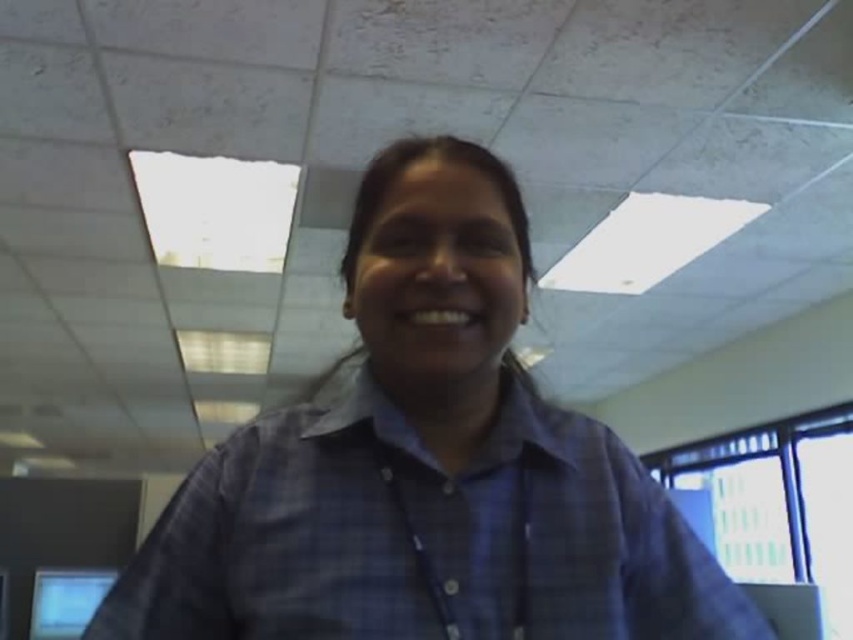
You are an office worker trying to locate your monitor. You see the blue plaid shirt at center and the matte black monitor at lower left. Which object is positioned higher in the image?

The blue plaid shirt at center is located above the matte black monitor at lower left, so it is positioned higher in the image.

You are an office worker who needs to move a small plant from point A to point B in the office. The coordinates of point A are point A at (x=306, y=396) and point B are point B at (x=42, y=593). According to the image, is point A behind point B from your current viewpoint?

Point A at (x=306, y=396) is behind point B at (x=42, y=593), so yes, point A is behind point B from your current viewpoint.